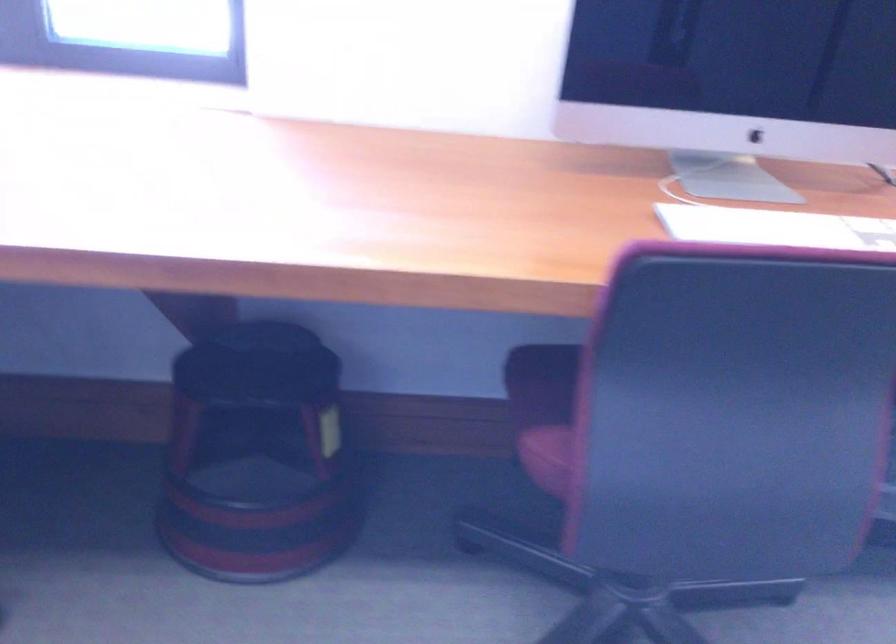
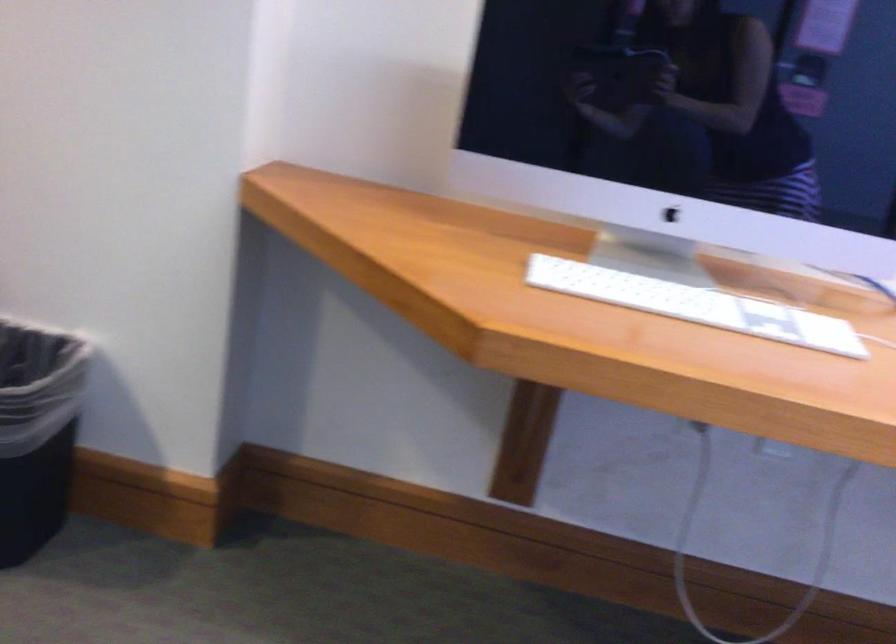
Question: In a continuous first-person perspective shot, in which direction is the camera moving?

Choices:
 (A) Left
 (B) Right
 (C) Forward
 (D) Backward

Answer: (A)